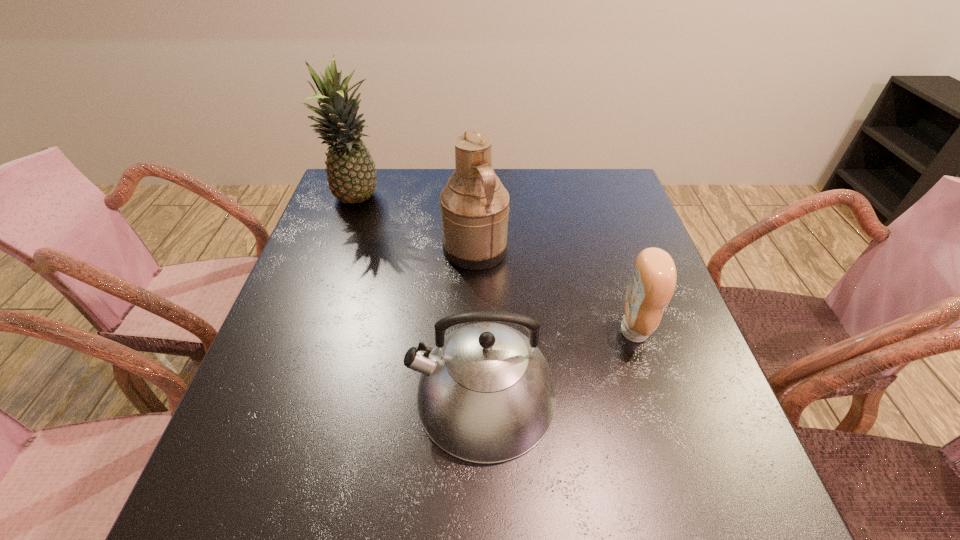
Where is `free space at the right edge of the desktop`? free space at the right edge of the desktop is located at coordinates (620, 351).

Find the location of a particular element. The width and height of the screenshot is (960, 540). free spot at the far right corner of the desktop is located at coordinates (624, 196).

The height and width of the screenshot is (540, 960). I want to click on free spot between the kettle and the third nearest object, so click(479, 322).

The width and height of the screenshot is (960, 540). Find the location of `free space that is in between the kettle and the rightmost object`. free space that is in between the kettle and the rightmost object is located at coordinates click(x=558, y=363).

This screenshot has height=540, width=960. Find the location of `free space between the kettle and the tallest object`. free space between the kettle and the tallest object is located at coordinates pyautogui.click(x=420, y=298).

I want to click on vacant space in between the farthest object and the pitcher, so click(417, 225).

Locate an element on the screen. The image size is (960, 540). free space between the second tallest object and the kettle is located at coordinates (479, 322).

Identify the location of empty space between the tallest object and the kettle. (420, 298).

Where is `empty space that is in between the condiment and the kettle`? empty space that is in between the condiment and the kettle is located at coordinates (558, 363).

Where is `empty space that is in between the kettle and the pineapple`? Image resolution: width=960 pixels, height=540 pixels. empty space that is in between the kettle and the pineapple is located at coordinates (420, 298).